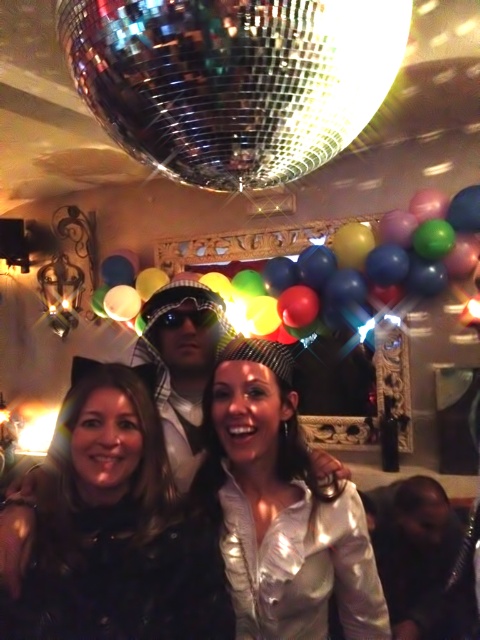
Does shiny silver jacket at center appear under shiny metallic balloons at upper center?

Yes, shiny silver jacket at center is below shiny metallic balloons at upper center.

Between shiny silver jacket at center and shiny metallic balloons at upper center, which one has less height?

shiny silver jacket at center

Which is in front, point (227, 368) or point (419, 259)?

Positioned in front is point (227, 368).

At what (x,y) coordinates should I click in order to perform the action: click on shiny silver jacket at center. Please return your answer as a coordinate pair (x, y). Looking at the image, I should click on (282, 508).

Can you confirm if shiny metallic balloons at upper center is smaller than shiny metallic balloon at upper center?

Incorrect, shiny metallic balloons at upper center is not smaller in size than shiny metallic balloon at upper center.

Can you confirm if shiny metallic balloons at upper center is shorter than shiny metallic balloon at upper center?

Yes, shiny metallic balloons at upper center is shorter than shiny metallic balloon at upper center.

Where is `shiny metallic balloons at upper center`? shiny metallic balloons at upper center is located at coordinates (348, 253).

I want to click on shiny metallic balloons at upper center, so click(x=348, y=253).

Who is shorter, shiny black jacket at center or shiny metallic balloon at upper center?

Standing shorter between the two is shiny black jacket at center.

Is shiny black jacket at center in front of shiny metallic balloon at upper center?

Yes.

This screenshot has height=640, width=480. I want to click on shiny black jacket at center, so click(113, 529).